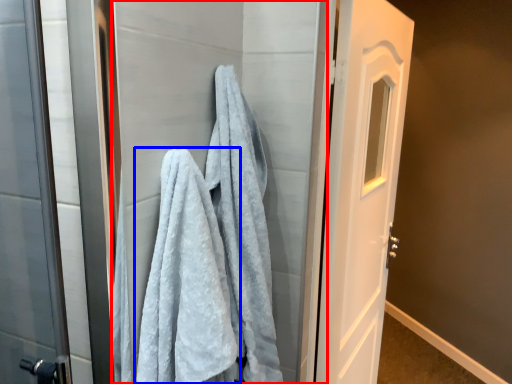
Question: Among these objects, which one is farthest to the camera, screen door (highlighted by a red box) or towel (highlighted by a blue box)?

Choices:
 (A) screen door
 (B) towel

Answer: (A)